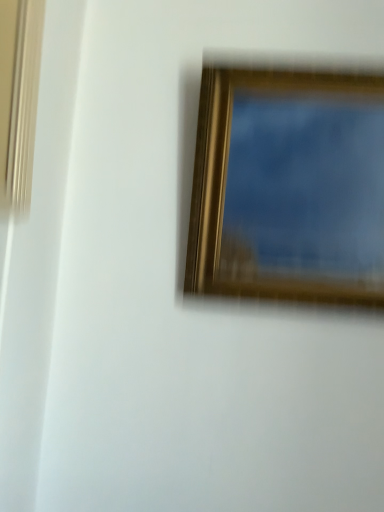
You are a GUI agent. You are given a task and a screenshot of the screen. Output one action in this format:
    pyautogui.click(x=<x>, y=<y>)
    Task: Click on the gold metallic picture frame at upper center
    The height and width of the screenshot is (512, 384).
    Given the screenshot: What is the action you would take?
    pyautogui.click(x=288, y=187)

Measure the distance between gold metallic picture frame at upper center and camera.

The distance of gold metallic picture frame at upper center from camera is 28.26 inches.

What do you see at coordinates (288, 187) in the screenshot? I see `gold metallic picture frame at upper center` at bounding box center [288, 187].

Where is `gold metallic picture frame at upper center`? The image size is (384, 512). gold metallic picture frame at upper center is located at coordinates (288, 187).